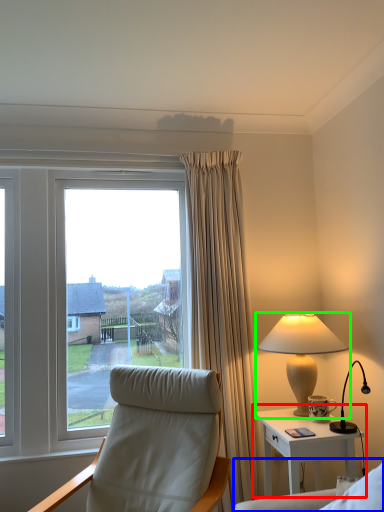
Question: Considering the real-world distances, which object is farthest from nightstand (highlighted by a red box)? couch (highlighted by a blue box) or lamp (highlighted by a green box)?

Choices:
 (A) couch
 (B) lamp

Answer: (A)